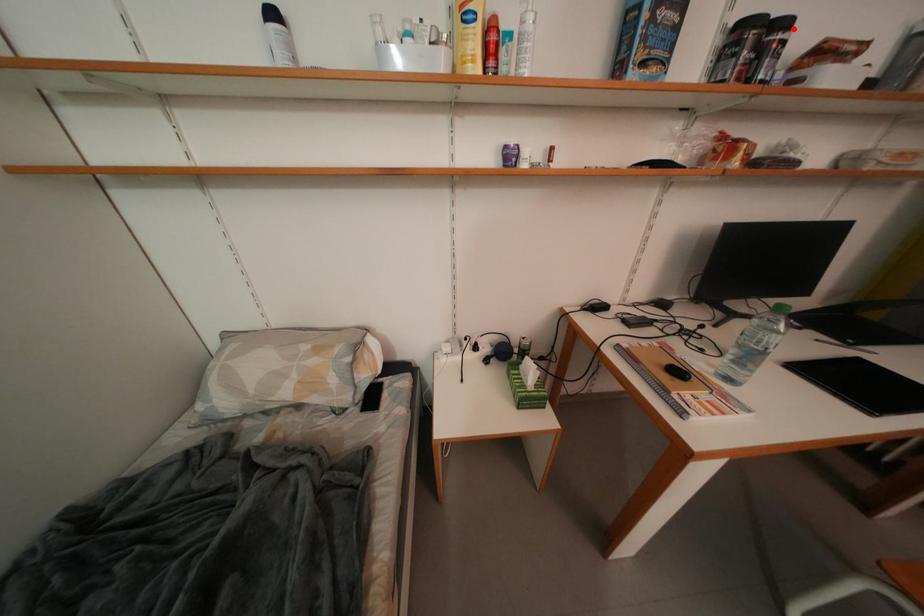
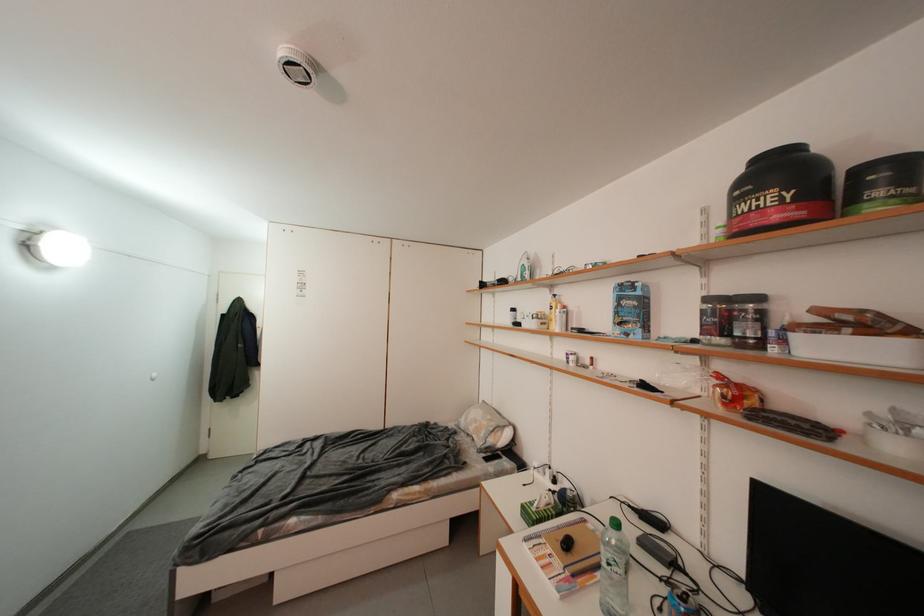
Where in the second image is the point corresponding to the highlighted location from the first image?

(766, 301)